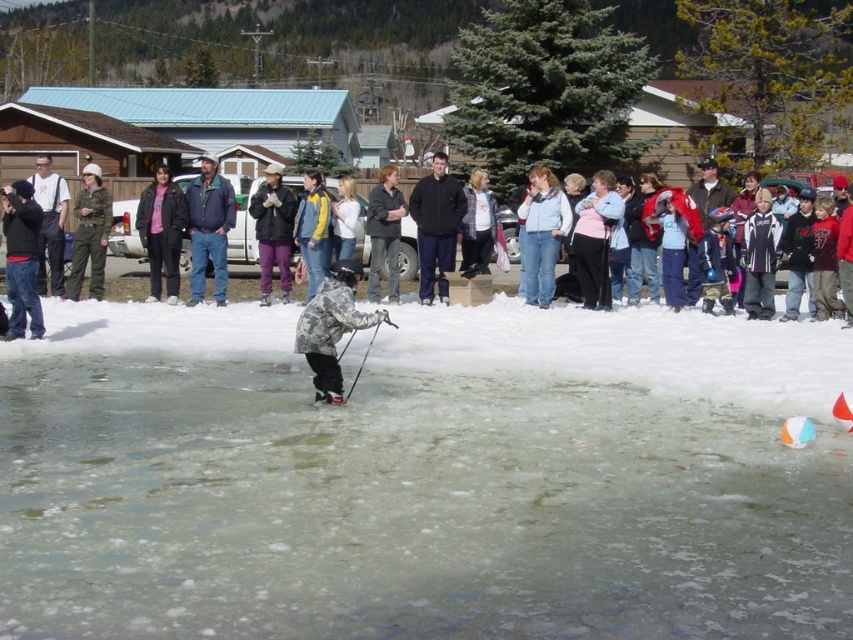
You are a winter sports instructor planning to set up a safety barrier around the translucent ice rink at center and the camouflage snowsuit at center. Which object requires a taller barrier to ensure safety?

The camouflage snowsuit at center requires a taller barrier because it is taller than the translucent ice rink at center.